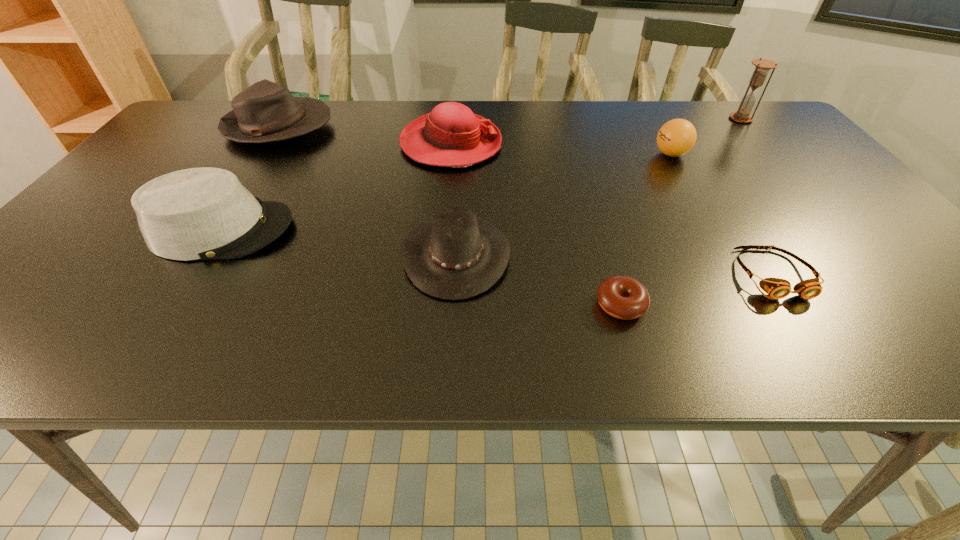
You are a GUI agent. You are given a task and a screenshot of the screen. Output one action in this format:
    pyautogui.click(x=<x>, y=<y>)
    Task: Click on the hourglass
    This screenshot has width=960, height=540.
    Given the screenshot: What is the action you would take?
    pyautogui.click(x=762, y=66)

Where is `the tallest object`? This screenshot has height=540, width=960. the tallest object is located at coordinates (762, 66).

Identify the location of ping-pong ball. The width and height of the screenshot is (960, 540). (677, 137).

I want to click on the shortest hat, so click(456, 256).

In order to click on goggles in this screenshot , I will do `click(777, 288)`.

The width and height of the screenshot is (960, 540). I want to click on the fifth object from left to right, so click(x=623, y=297).

The height and width of the screenshot is (540, 960). Find the location of `vacant space located on the front of the rightmost object`. vacant space located on the front of the rightmost object is located at coordinates (766, 148).

Where is `blank area located 0.210m on the side with brand of the ping-pong ball`? blank area located 0.210m on the side with brand of the ping-pong ball is located at coordinates coord(576,154).

I want to click on free space located on the side with brand of the ping-pong ball, so click(631, 154).

Image resolution: width=960 pixels, height=540 pixels. In order to click on blank area located 0.270m on the side with brand of the ping-pong ball in this screenshot , I will do `click(554, 154)`.